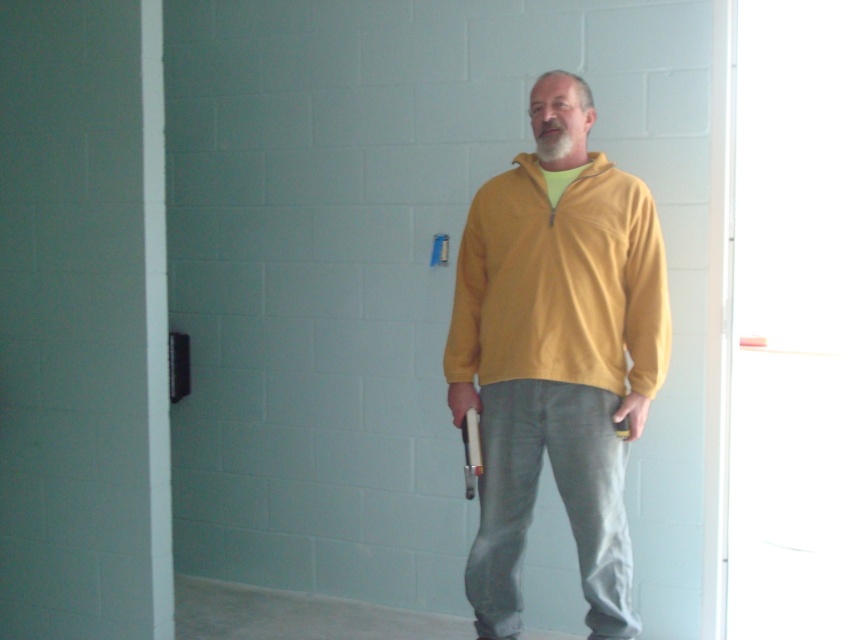
You are trying to decide which item to take with you based on thickness. You see a yellow fleece jacket at center and a yellow fleece sweatshirt at center. Which one is thicker?

The yellow fleece sweatshirt at center is thicker than the yellow fleece jacket at center.

You are an interior designer who wants to hang a decorative painting on the wall. The painting is 1.2 meters wide. The yellow fleece jacket at center is located at point 0.555 on the horizontal axis and 0.653 on the vertical axis. The wall has a total width of 3 meters. Is there enough space to hang the painting horizontally without overlapping the jacket?

The yellow fleece jacket at center is located at point 0.555 on the horizontal axis. The wall is 3 meters wide. The painting is 1.2 meters wide. To check if there is enough space, we calculate the required space around the jacket. The jacket is centered at 0.555, so the left edge of the jacket would be at 0.555 minus half its width, and the right edge similarly. However, since the jacket width isn not provided, we can assume it occupies a small area. If the jacket is small, there might be enough space on e

You are a fashion designer trying to create a new line of layered outfits. You have two yellow fleece items in front of you, a yellow fleece jacket at center and a yellow fleece sweatshirt at center. Which one should you place on top to create a layered look that emphasizes verticality?

The yellow fleece jacket at center is much taller than the yellow fleece sweatshirt at center, so placing the jacket on top would create a layered look that emphasizes verticality.